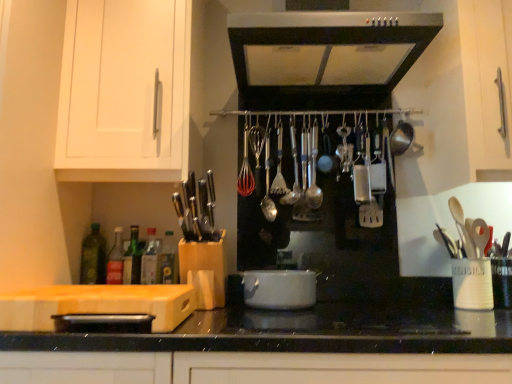
Question: Can you confirm if green glass bottle at lower left, marked as the 3th bottle in a right-to-left arrangement, is bigger than green glass bottle at left, arranged as the fifth bottle when viewed from the right?

Choices:
 (A) yes
 (B) no

Answer: (B)

Question: Is green glass bottle at lower left, marked as the third bottle in a left-to-right arrangement, thinner than green glass bottle at left, arranged as the fifth bottle when viewed from the right?

Choices:
 (A) yes
 (B) no

Answer: (B)

Question: Is green glass bottle at lower left, marked as the third bottle in a left-to-right arrangement, positioned with its back to green glass bottle at left, arranged as the fifth bottle when viewed from the right?

Choices:
 (A) yes
 (B) no

Answer: (B)

Question: Is green glass bottle at lower left, marked as the 3th bottle in a right-to-left arrangement, positioned behind green glass bottle at left, the 1th bottle positioned from the left?

Choices:
 (A) no
 (B) yes

Answer: (A)

Question: Can you confirm if green glass bottle at lower left, marked as the third bottle in a left-to-right arrangement, is positioned to the left of green glass bottle at left, the 1th bottle positioned from the left?

Choices:
 (A) yes
 (B) no

Answer: (B)

Question: From a real-world perspective, is green glass bottle at lower left, marked as the 3th bottle in a right-to-left arrangement, positioned over green glass bottle at left, arranged as the fifth bottle when viewed from the right, based on gravity?

Choices:
 (A) yes
 (B) no

Answer: (B)

Question: From a real-world perspective, is green glass bottle at center, the 5th bottle in the left-to-right sequence, on top of translucent glass bottle at left, the fourth bottle when ordered from right to left?

Choices:
 (A) no
 (B) yes

Answer: (A)

Question: Is green glass bottle at center, the first bottle in the right-to-left sequence, next to translucent glass bottle at left, placed as the second bottle when sorted from left to right?

Choices:
 (A) no
 (B) yes

Answer: (A)

Question: Are green glass bottle at center, the 5th bottle in the left-to-right sequence, and translucent glass bottle at left, the fourth bottle when ordered from right to left, located far from each other?

Choices:
 (A) yes
 (B) no

Answer: (B)

Question: Is translucent glass bottle at left, placed as the second bottle when sorted from left to right, inside green glass bottle at center, the first bottle in the right-to-left sequence?

Choices:
 (A) yes
 (B) no

Answer: (B)

Question: Considering the relative positions of green glass bottle at center, the 5th bottle in the left-to-right sequence, and translucent glass bottle at left, the fourth bottle when ordered from right to left, in the image provided, is green glass bottle at center, the 5th bottle in the left-to-right sequence, to the left of translucent glass bottle at left, the fourth bottle when ordered from right to left, from the viewer's perspective?

Choices:
 (A) no
 (B) yes

Answer: (A)

Question: Is green glass bottle at center, the 5th bottle in the left-to-right sequence, thinner than translucent glass bottle at left, placed as the second bottle when sorted from left to right?

Choices:
 (A) yes
 (B) no

Answer: (A)

Question: Can green glass bottle at lower left, marked as the 3th bottle in a right-to-left arrangement, be found inside green glass bottle at left, arranged as the fifth bottle when viewed from the right?

Choices:
 (A) no
 (B) yes

Answer: (A)